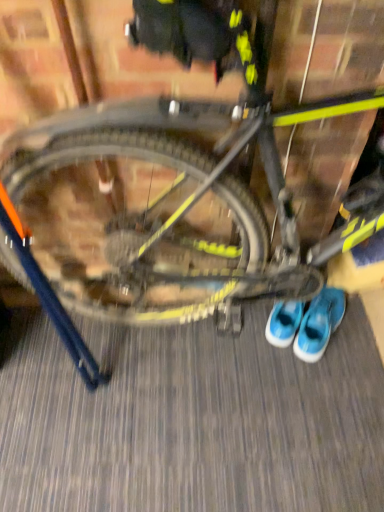
Where is `free space to the left of blue suede sneakers at lower right`? This screenshot has width=384, height=512. free space to the left of blue suede sneakers at lower right is located at coordinates (255, 342).